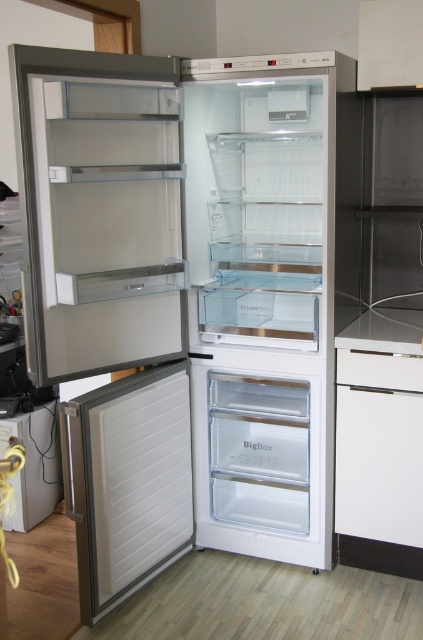
Question: Among these points, which one is nearest to the camera?

Choices:
 (A) (400, 339)
 (B) (299, 476)

Answer: (A)

Question: Which object is farther from the camera taking this photo?

Choices:
 (A) transparent plastic drawer at center
 (B) white matte door at lower left
 (C) white glossy counter top at lower right

Answer: (A)

Question: Which of the following is the farthest from the observer?

Choices:
 (A) (236, 380)
 (B) (381, 317)
 (C) (85, 496)

Answer: (B)

Question: Is white matte door at lower left smaller than white glossy counter top at lower right?

Choices:
 (A) yes
 (B) no

Answer: (B)

Question: Does transparent plastic drawer at center appear under white glossy counter top at lower right?

Choices:
 (A) yes
 (B) no

Answer: (A)

Question: Does transparent plastic drawer at center have a greater width compared to white glossy counter top at lower right?

Choices:
 (A) yes
 (B) no

Answer: (A)